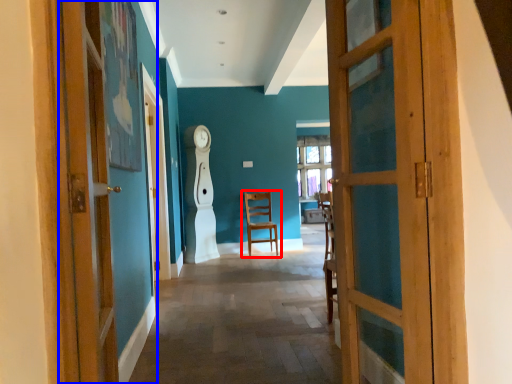
Question: Which of the following is the farthest to the observer, chair (highlighted by a red box) or door (highlighted by a blue box)?

Choices:
 (A) chair
 (B) door

Answer: (A)